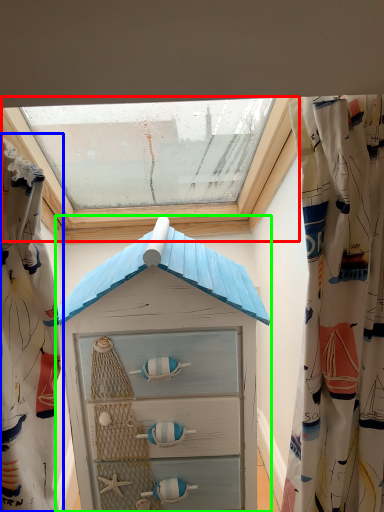
Question: Which object is the closest to the window (highlighted by a red box)? Choose among these: curtain (highlighted by a blue box) or beach hut (highlighted by a green box).

Choices:
 (A) curtain
 (B) beach hut

Answer: (B)